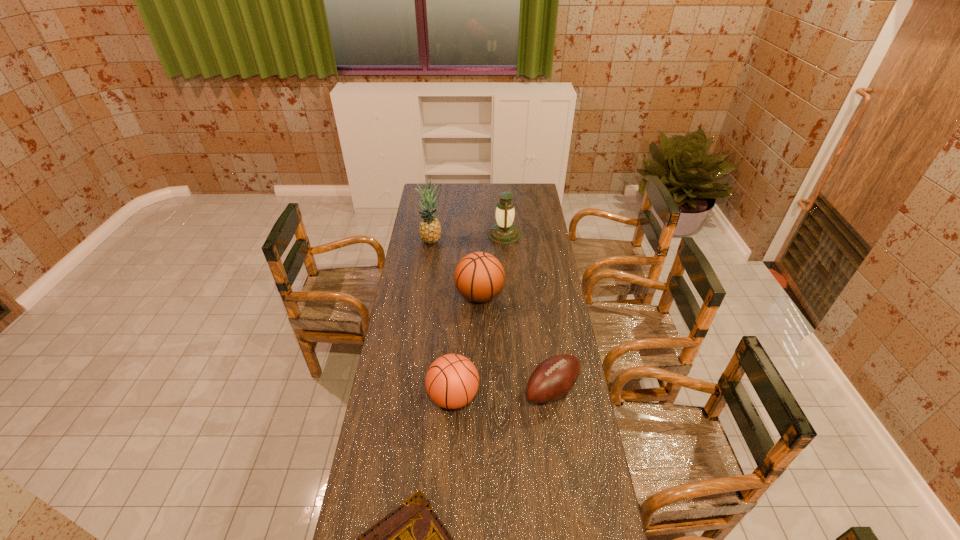
At what (x,y) coordinates should I click in order to perform the action: click on the tallest object. Please return your answer as a coordinate pair (x, y). The height and width of the screenshot is (540, 960). Looking at the image, I should click on (429, 228).

Image resolution: width=960 pixels, height=540 pixels. Find the location of `lantern`. lantern is located at coordinates (504, 231).

The image size is (960, 540). Identify the location of the farther basketball. (479, 277).

Locate an element on the screen. the fourth tallest object is located at coordinates (452, 380).

Locate an element on the screen. the shorter basketball is located at coordinates (452, 380).

Image resolution: width=960 pixels, height=540 pixels. I want to click on football (American), so click(553, 378).

You are a GUI agent. You are given a task and a screenshot of the screen. Output one action in this format:
    pyautogui.click(x=<x>, y=<y>)
    Task: Click on the vacant space located on the back of the tallest object
    The image size is (960, 540).
    Given the screenshot: What is the action you would take?
    435,210

The width and height of the screenshot is (960, 540). Identify the location of vacant space situated with the light compartment facing forward on the lantern. (438, 235).

Where is `free space located 0.330m with the light compartment facing forward on the lantern`? free space located 0.330m with the light compartment facing forward on the lantern is located at coordinates (428, 235).

Find the location of a particular element. The height and width of the screenshot is (540, 960). free space located with the light compartment facing forward on the lantern is located at coordinates (452, 235).